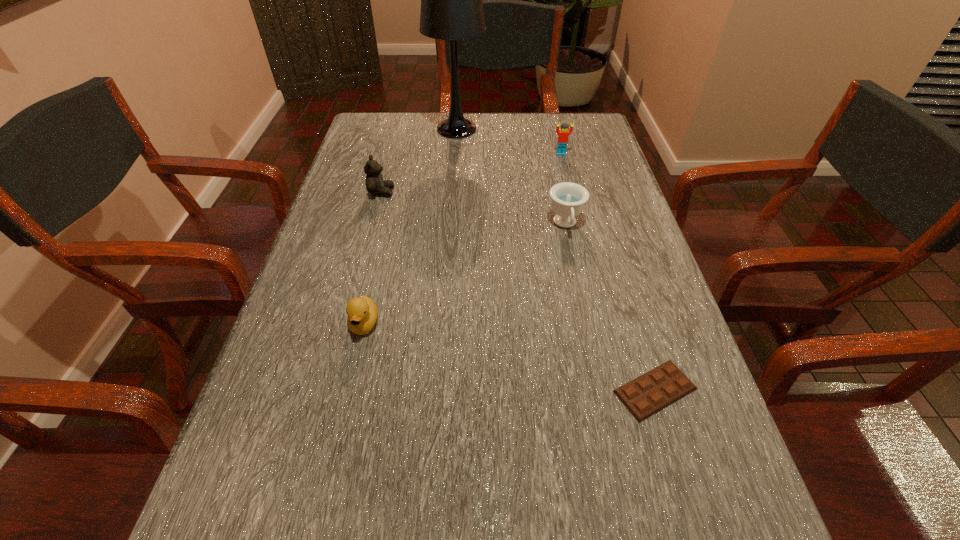
Locate an element on the screen. vacant point that satisfies the following two spatial constraints: 1. on the face of the Lego; 2. on the right side of the nearest object is located at coordinates (618, 390).

The image size is (960, 540). I want to click on vacant space that satisfies the following two spatial constraints: 1. facing forward on the duckling; 2. on the right side of the chocolate bar, so click(349, 390).